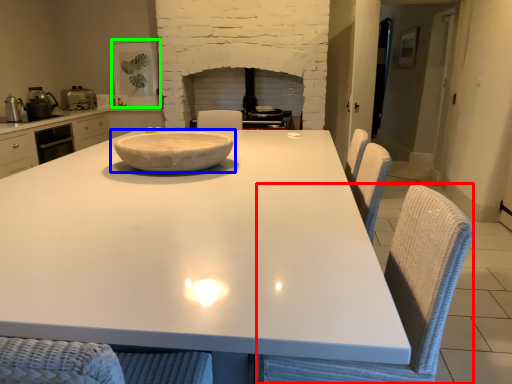
Question: Estimate the real-world distances between objects in this image. Which object is closer to swivel chair (highlighted by a red box), bowl (highlighted by a blue box) or appliance (highlighted by a green box)?

Choices:
 (A) bowl
 (B) appliance

Answer: (A)